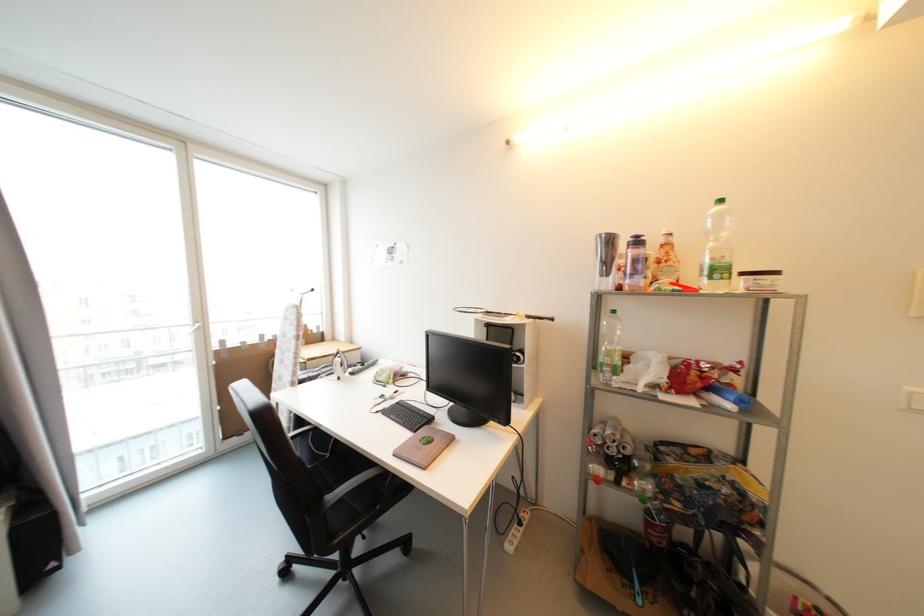
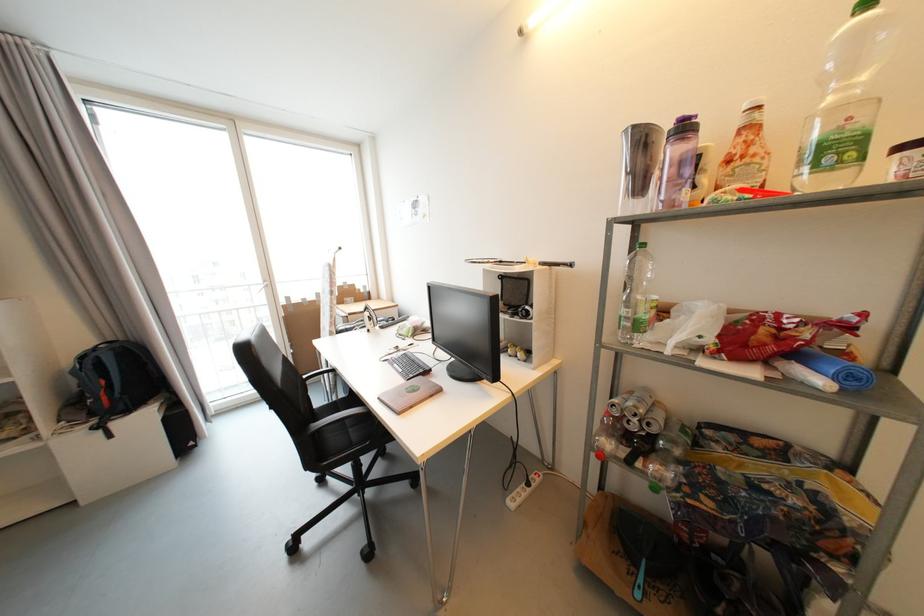
Find the pixel in the second image that matches the point at 201,323 in the first image.

(271, 283)